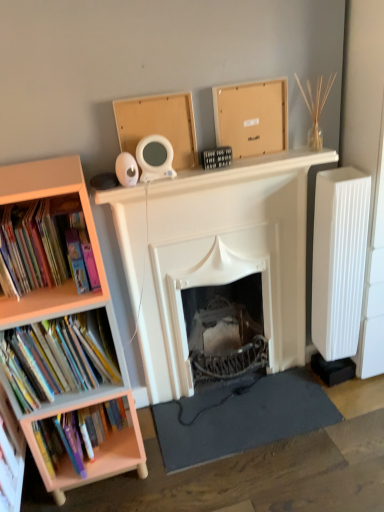
Question: Is hardcover books at left, the second book when ordered from top to bottom, positioned beyond the bounds of matte cardboard box at upper center, arranged as the 1th cardboard box when viewed from the right?

Choices:
 (A) yes
 (B) no

Answer: (A)

Question: Can you confirm if hardcover books at left, the second book when ordered from top to bottom, is thinner than matte cardboard box at upper center, the 2th cardboard box viewed from the left?

Choices:
 (A) no
 (B) yes

Answer: (A)

Question: Would you say matte cardboard box at upper center, the 2th cardboard box viewed from the left, is part of hardcover books at left, the second book from the bottom,'s contents?

Choices:
 (A) no
 (B) yes

Answer: (A)

Question: Can you confirm if hardcover books at left, the second book when ordered from top to bottom, is positioned to the right of matte cardboard box at upper center, arranged as the 1th cardboard box when viewed from the right?

Choices:
 (A) no
 (B) yes

Answer: (A)

Question: Considering the relative sizes of hardcover books at left, the second book when ordered from top to bottom, and matte cardboard box at upper center, arranged as the 1th cardboard box when viewed from the right, in the image provided, is hardcover books at left, the second book when ordered from top to bottom, smaller than matte cardboard box at upper center, arranged as the 1th cardboard box when viewed from the right,?

Choices:
 (A) yes
 (B) no

Answer: (B)

Question: Considering the relative positions of matte cardboard box at upper center, arranged as the 1th cardboard box when viewed from the right, and white ribbed radiator at right in the image provided, is matte cardboard box at upper center, arranged as the 1th cardboard box when viewed from the right, to the left or to the right of white ribbed radiator at right?

Choices:
 (A) right
 (B) left

Answer: (B)

Question: Which is correct: matte cardboard box at upper center, arranged as the 1th cardboard box when viewed from the right, is inside white ribbed radiator at right, or outside of it?

Choices:
 (A) inside
 (B) outside

Answer: (B)

Question: Does point (283, 77) appear closer or farther from the camera than point (364, 201)?

Choices:
 (A) closer
 (B) farther

Answer: (A)

Question: Considering the positions of matte cardboard box at upper center, the 2th cardboard box viewed from the left, and white ribbed radiator at right in the image, is matte cardboard box at upper center, the 2th cardboard box viewed from the left, wider or thinner than white ribbed radiator at right?

Choices:
 (A) wide
 (B) thin

Answer: (B)

Question: From the image's perspective, is dark gray rubber mat at lower center located above or below matte cardboard box at upper center, arranged as the 1th cardboard box when viewed from the right?

Choices:
 (A) below
 (B) above

Answer: (A)

Question: Considering their positions, is dark gray rubber mat at lower center located in front of or behind matte cardboard box at upper center, arranged as the 1th cardboard box when viewed from the right?

Choices:
 (A) behind
 (B) front

Answer: (A)

Question: Is dark gray rubber mat at lower center wider or thinner than matte cardboard box at upper center, the 2th cardboard box viewed from the left?

Choices:
 (A) wide
 (B) thin

Answer: (A)

Question: Based on their sizes in the image, would you say dark gray rubber mat at lower center is bigger or smaller than matte cardboard box at upper center, the 2th cardboard box viewed from the left?

Choices:
 (A) big
 (B) small

Answer: (A)

Question: In terms of height, does white ribbed radiator at right look taller or shorter compared to dark gray rubber mat at lower center?

Choices:
 (A) tall
 (B) short

Answer: (A)

Question: Would you say white ribbed radiator at right is to the left or to the right of dark gray rubber mat at lower center in the picture?

Choices:
 (A) right
 (B) left

Answer: (A)